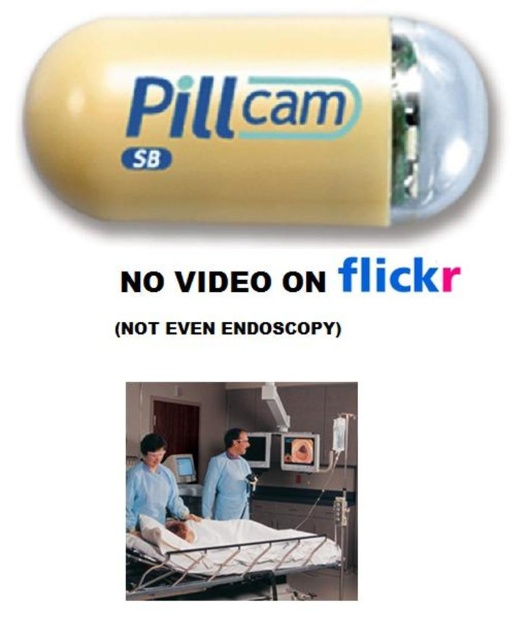
Which of these two, white mesh hospital bed at center or matte blue uniform at center, stands taller?

matte blue uniform at center is taller.

Which is above, white mesh hospital bed at center or matte blue uniform at center?

matte blue uniform at center is above.

Is point (152, 534) farther from viewer compared to point (231, 433)?

No, (152, 534) is in front of (231, 433).

I want to click on white mesh hospital bed at center, so click(x=219, y=554).

Who is taller, blue fabric doctor at center or matte blue uniform at center?

Standing taller between the two is matte blue uniform at center.

Where is `blue fabric doctor at center`? blue fabric doctor at center is located at coordinates (153, 486).

This screenshot has width=528, height=640. Describe the element at coordinates (153, 486) in the screenshot. I see `blue fabric doctor at center` at that location.

The height and width of the screenshot is (640, 528). What are the coordinates of `blue fabric doctor at center` in the screenshot? It's located at (153, 486).

Does white mesh hospital bed at center appear on the left side of blue fabric doctor at center?

In fact, white mesh hospital bed at center is to the right of blue fabric doctor at center.

Does point (280, 566) come in front of point (149, 474)?

Yes, it is in front of point (149, 474).

In order to click on white mesh hospital bed at center in this screenshot , I will do `click(219, 554)`.

Where is `white mesh hospital bed at center`? white mesh hospital bed at center is located at coordinates (219, 554).